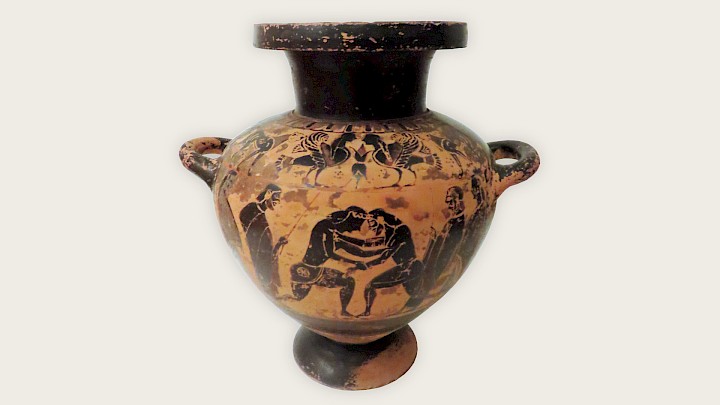
The height and width of the screenshot is (405, 720). In order to click on vase lip in this screenshot , I will do `click(343, 27)`.